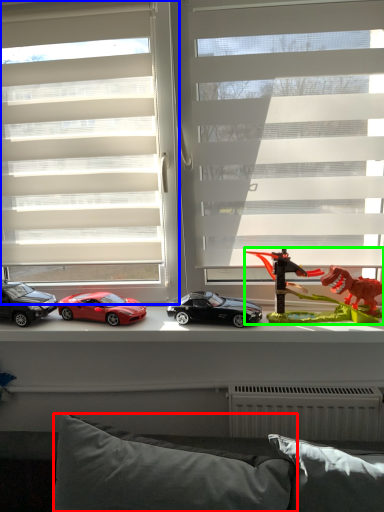
Question: Considering the real-world distances, which object is farthest from pillow (highlighted by a red box)? window (highlighted by a blue box) or toy (highlighted by a green box)?

Choices:
 (A) window
 (B) toy

Answer: (A)